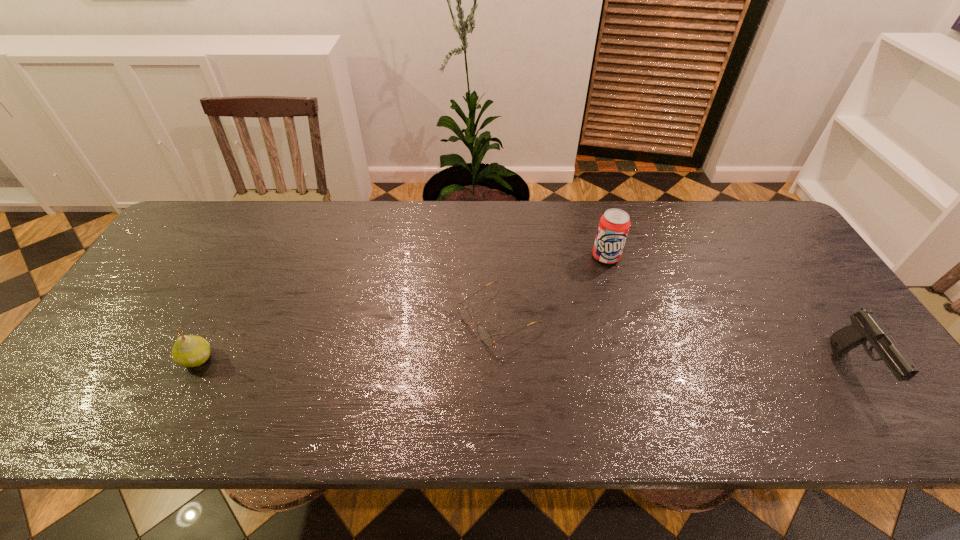
The height and width of the screenshot is (540, 960). I want to click on vacant space at the left edge of the desktop, so click(x=174, y=296).

In the image, there is a desktop. Identify the location of vacant space at the right edge. (817, 283).

Locate an element on the screen. vacant area at the far left corner of the desktop is located at coordinates (234, 209).

The width and height of the screenshot is (960, 540). In the image, there is a desktop. What are the coordinates of `vacant space at the near left corner` in the screenshot? It's located at (101, 368).

The image size is (960, 540). What are the coordinates of `vacant space at the far right corner` in the screenshot? It's located at (751, 206).

Where is `vacant area that lies between the leftmost object and the shortest object`? vacant area that lies between the leftmost object and the shortest object is located at coordinates (348, 338).

The height and width of the screenshot is (540, 960). In order to click on vacant point located between the spectacles and the soda can in this screenshot , I will do `click(552, 287)`.

This screenshot has height=540, width=960. What are the coordinates of `vacant space that is in between the rightmost object and the spectacles` in the screenshot? It's located at (677, 342).

Locate an element on the screen. Image resolution: width=960 pixels, height=540 pixels. free point between the shortest object and the tallest object is located at coordinates (552, 287).

Locate an element on the screen. This screenshot has width=960, height=540. free space between the farthest object and the shortest object is located at coordinates (552, 287).